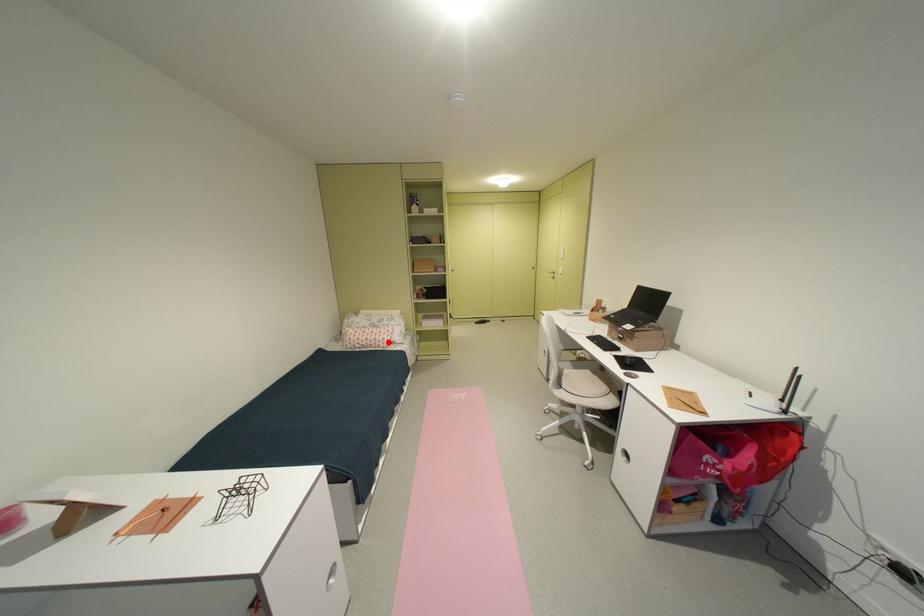
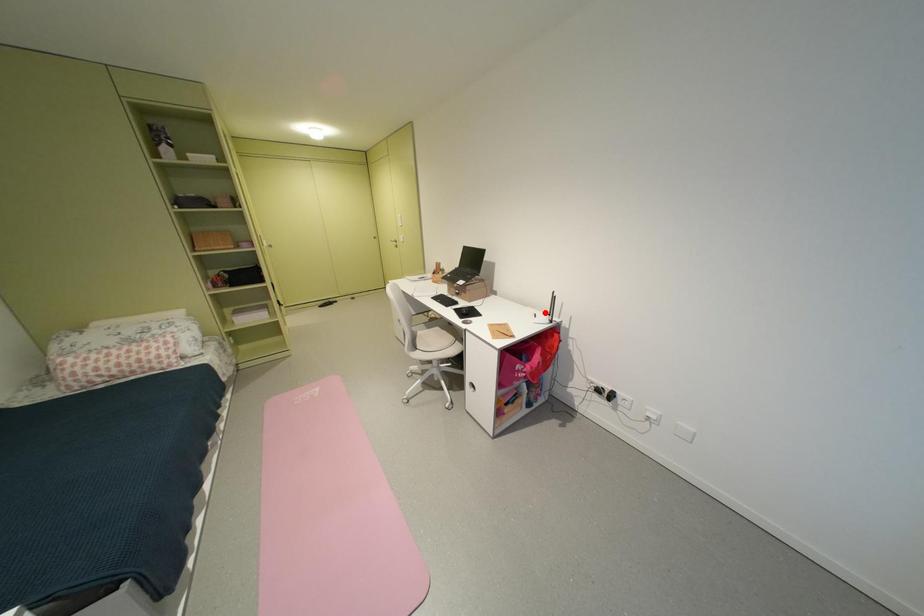
I am providing you with two images of the same scene from different viewpoints. A red point is marked on the first image and another point is marked on the second image. Are the points marked in image1 and image2 representing the same 3D position?

No